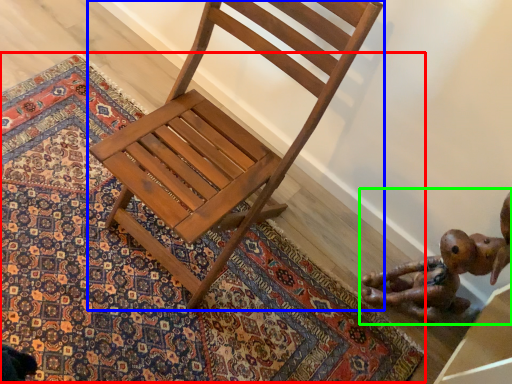
Question: Considering the real-world distances, which object is closest to mat (highlighted by a red box)? chair (highlighted by a blue box) or toy (highlighted by a green box).

Choices:
 (A) chair
 (B) toy

Answer: (A)